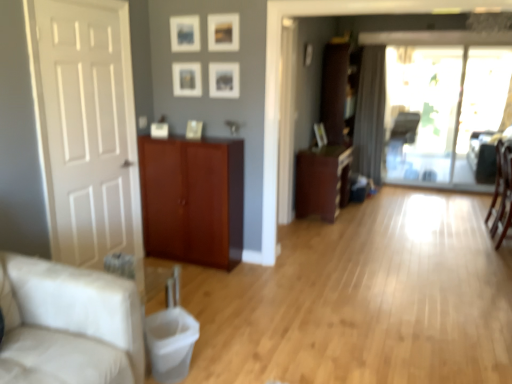
Question: Which direction should I rotate to face matte wood cabinet at center, which ranks as the second cabinetry in back-to-front order, — up or down?

Choices:
 (A) down
 (B) up

Answer: (B)

Question: Is matte wood cabinet at center, the 2th cabinetry when ordered from right to left, in front of brown wood cabinet at center, marked as the 1th cabinetry in a right-to-left arrangement?

Choices:
 (A) no
 (B) yes

Answer: (B)

Question: From the image's perspective, is matte wood cabinet at center, the 2th cabinetry when ordered from right to left, located above brown wood cabinet at center, the third cabinetry positioned from the left?

Choices:
 (A) no
 (B) yes

Answer: (A)

Question: Is matte wood cabinet at center, which is the 2th cabinetry in left-to-right order, further to camera compared to brown wood cabinet at center, the first cabinetry when ordered from back to front?

Choices:
 (A) yes
 (B) no

Answer: (B)

Question: Does matte wood cabinet at center, the 2th cabinetry when ordered from right to left, turn towards brown wood cabinet at center, the third cabinetry positioned from the left?

Choices:
 (A) yes
 (B) no

Answer: (B)

Question: Can you confirm if matte wood cabinet at center, which is the 2th cabinetry in left-to-right order, is wider than brown wood cabinet at center, the third cabinetry positioned from the left?

Choices:
 (A) no
 (B) yes

Answer: (B)

Question: Is matte wood cabinet at center, which ranks as the second cabinetry in back-to-front order, looking in the opposite direction of brown wood cabinet at center, the first cabinetry when ordered from back to front?

Choices:
 (A) yes
 (B) no

Answer: (B)

Question: Is transparent glass door at center shorter than matte black armchair at center?

Choices:
 (A) no
 (B) yes

Answer: (A)

Question: Is transparent glass door at center far from matte black armchair at center?

Choices:
 (A) no
 (B) yes

Answer: (A)

Question: Is matte black armchair at center inside transparent glass door at center?

Choices:
 (A) no
 (B) yes

Answer: (A)

Question: Does transparent glass door at center appear on the right side of matte black armchair at center?

Choices:
 (A) yes
 (B) no

Answer: (A)

Question: Would you say transparent glass door at center is outside matte black armchair at center?

Choices:
 (A) no
 (B) yes

Answer: (B)

Question: From the image's perspective, would you say transparent glass door at center is positioned over matte black armchair at center?

Choices:
 (A) no
 (B) yes

Answer: (B)

Question: Is matte wood cabinet at center, placed as the second cabinetry when sorted from front to back, not near beige fabric couch at left?

Choices:
 (A) no
 (B) yes

Answer: (B)